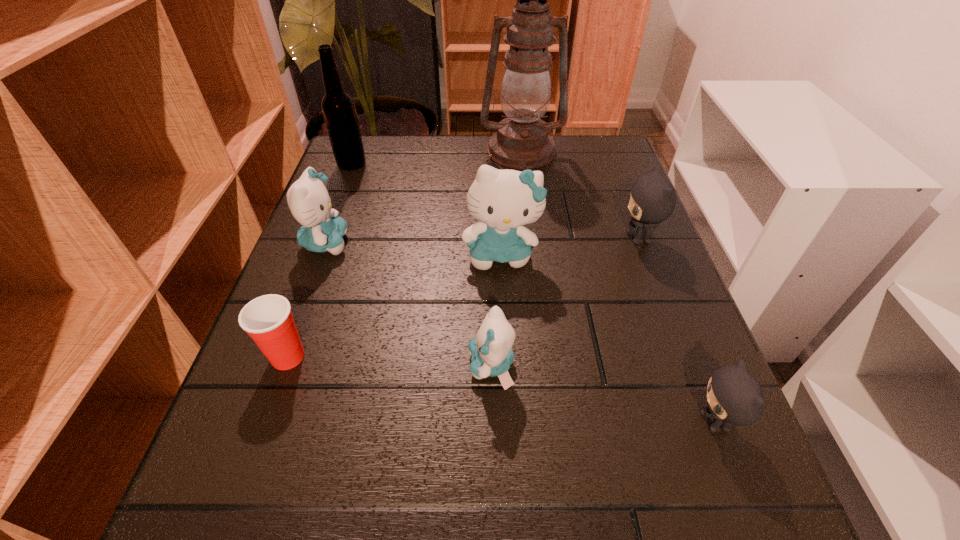
Where is `oil lamp`? The height and width of the screenshot is (540, 960). oil lamp is located at coordinates (522, 142).

I want to click on the seventh shortest object, so click(338, 107).

Find the location of a particular element. This screenshot has width=960, height=540. the tallest kitten is located at coordinates (502, 200).

This screenshot has width=960, height=540. I want to click on the sixth shortest object, so click(502, 200).

The height and width of the screenshot is (540, 960). Identify the location of the leftmost kitten. (309, 201).

You are a GUI agent. You are given a task and a screenshot of the screen. Output one action in this format:
    pyautogui.click(x=<x>, y=<y>)
    Task: Click on the second biggest blue kitten
    
    Given the screenshot: What is the action you would take?
    pyautogui.click(x=309, y=201)

You are a GUI agent. You are given a task and a screenshot of the screen. Output one action in this format:
    pyautogui.click(x=<x>, y=<y>)
    Task: Click on the bigger gray kitten
    The width and height of the screenshot is (960, 540).
    Given the screenshot: What is the action you would take?
    pyautogui.click(x=652, y=200)

The height and width of the screenshot is (540, 960). Identify the location of the nearest blue kitten. (492, 354).

Locate an element on the screen. Image resolution: width=960 pixels, height=540 pixels. red Dixie cup is located at coordinates coord(268,320).

Locate an element on the screen. This screenshot has height=540, width=960. the nearer gray kitten is located at coordinates (734, 397).